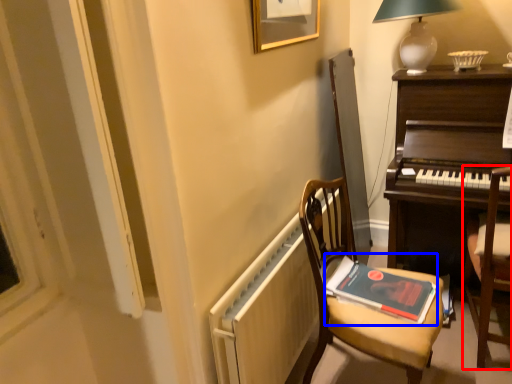
Question: Which object appears farthest to the camera in this image, chair (highlighted by a red box) or paperback book (highlighted by a blue box)?

Choices:
 (A) chair
 (B) paperback book

Answer: (B)